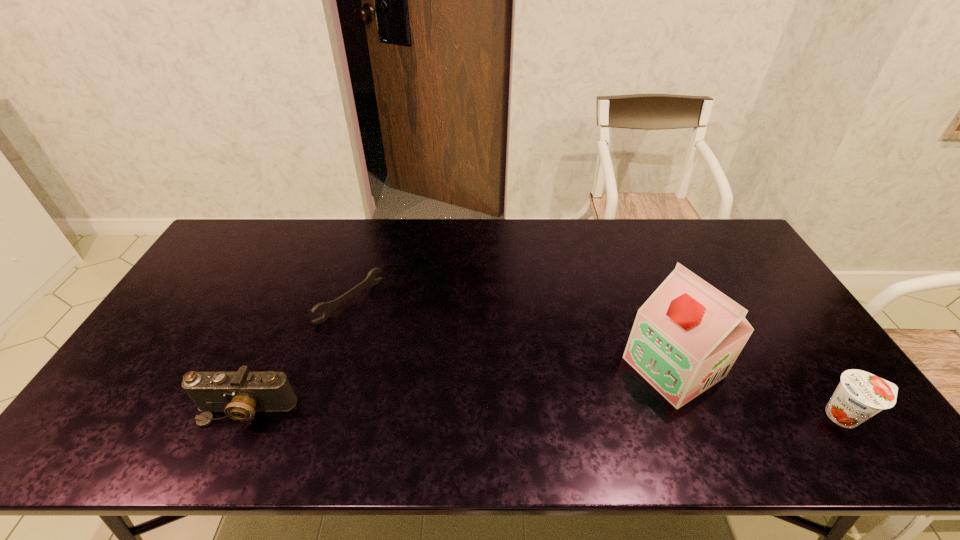
Locate an element on the screen. The width and height of the screenshot is (960, 540). camera is located at coordinates (240, 394).

Find the location of a particular element. The image size is (960, 540). the rightmost object is located at coordinates (860, 395).

Identify the location of the shortest object. (328, 307).

The height and width of the screenshot is (540, 960). In order to click on wrench in this screenshot , I will do `click(328, 307)`.

At what (x,y) coordinates should I click in order to perform the action: click on soya milk. Please return your answer as a coordinate pair (x, y). The image size is (960, 540). Looking at the image, I should click on (686, 337).

The width and height of the screenshot is (960, 540). I want to click on the tallest object, so click(686, 337).

Identify the location of vacant space located on the left of the yogurt. The image size is (960, 540). pyautogui.click(x=758, y=415).

The image size is (960, 540). Find the location of `free space located on the open ends of the wrench`. free space located on the open ends of the wrench is located at coordinates (399, 339).

This screenshot has height=540, width=960. In order to click on vacant space located on the open ends of the wrench in this screenshot , I will do `click(467, 387)`.

Where is `free region located 0.280m on the open ends of the wrench`? The width and height of the screenshot is (960, 540). free region located 0.280m on the open ends of the wrench is located at coordinates (438, 367).